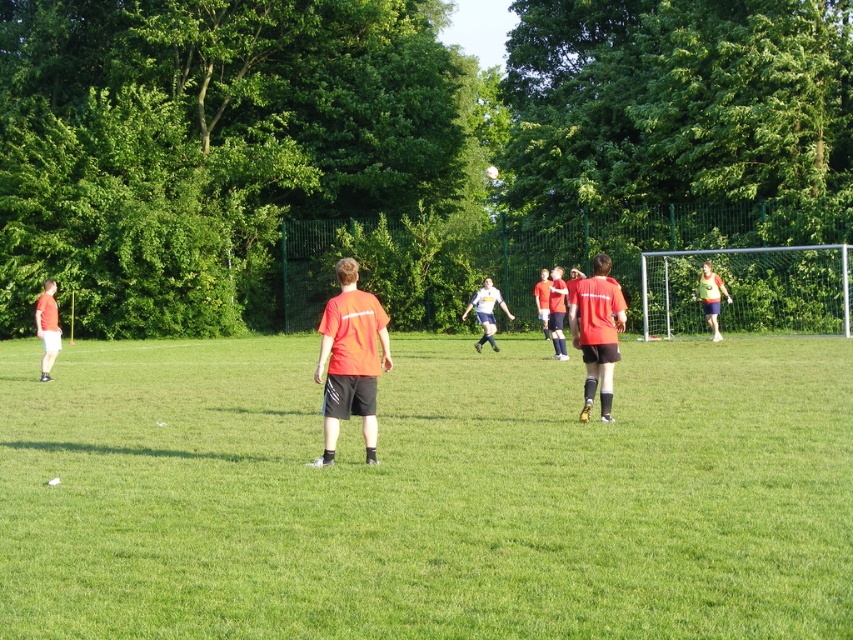
Does point (602, 289) come behind point (480, 301)?

No, (602, 289) is in front of (480, 301).

Is matte red shirt at center shorter than white jersey at center?

No.

Who is more forward, (590, 323) or (491, 282)?

Positioned in front is point (590, 323).

Where is `matte red shirt at center`? matte red shirt at center is located at coordinates (596, 332).

Between white jersey at center and green matte jersey at right, which one appears on the right side from the viewer's perspective?

green matte jersey at right

How far apart are white jersey at center and green matte jersey at right?

white jersey at center and green matte jersey at right are 5.42 meters apart.

Is point (486, 301) closer to camera compared to point (715, 301)?

Yes, point (486, 301) is closer to viewer.

Where is `white jersey at center`? The height and width of the screenshot is (640, 853). white jersey at center is located at coordinates (486, 310).

Between green grass field at center and white jersey at center, which one appears on the right side from the viewer's perspective?

white jersey at center

You are a GUI agent. You are given a task and a screenshot of the screen. Output one action in this format:
    pyautogui.click(x=<x>, y=<y>)
    Task: Click on the green grass field at center
    Image resolution: width=853 pixels, height=640 pixels.
    Given the screenshot: What is the action you would take?
    pyautogui.click(x=427, y=493)

This screenshot has width=853, height=640. I want to click on green grass field at center, so click(427, 493).